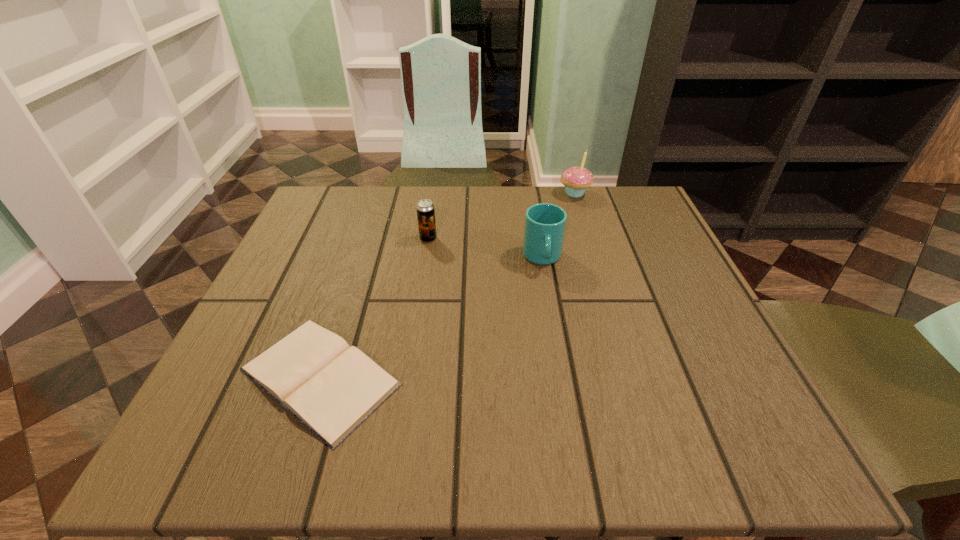
Where is `unoccupied area between the third object from left to right and the beer can`? The image size is (960, 540). unoccupied area between the third object from left to right and the beer can is located at coordinates (486, 248).

What are the coordinates of `vacant area between the second object from right to left and the Bible` in the screenshot? It's located at (431, 317).

Where is `free point between the beer can and the third object from left to right`? free point between the beer can and the third object from left to right is located at coordinates (486, 248).

Where is `vacant space that's between the cupcake and the Bible`? The image size is (960, 540). vacant space that's between the cupcake and the Bible is located at coordinates (447, 285).

Locate which object is the second closest to the shortest object. Please provide its 2D coordinates. Your answer should be formatted as a tuple, i.e. [(x, y)], where the tuple contains the x and y coordinates of a point satisfying the conditions above.

[(545, 223)]

Locate an element on the screen. This screenshot has height=540, width=960. the second closest object to the nearest object is located at coordinates [545, 223].